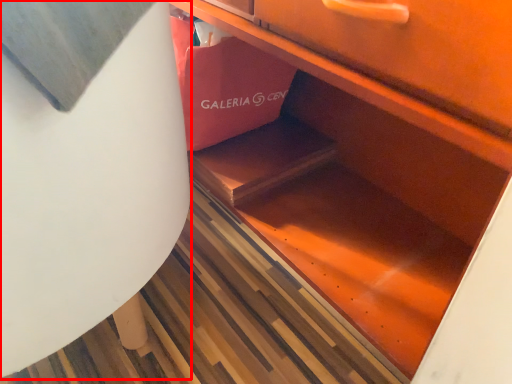
Question: Where is round table (annotated by the red box) located in relation to shopping bag in the image?

Choices:
 (A) right
 (B) left

Answer: (B)